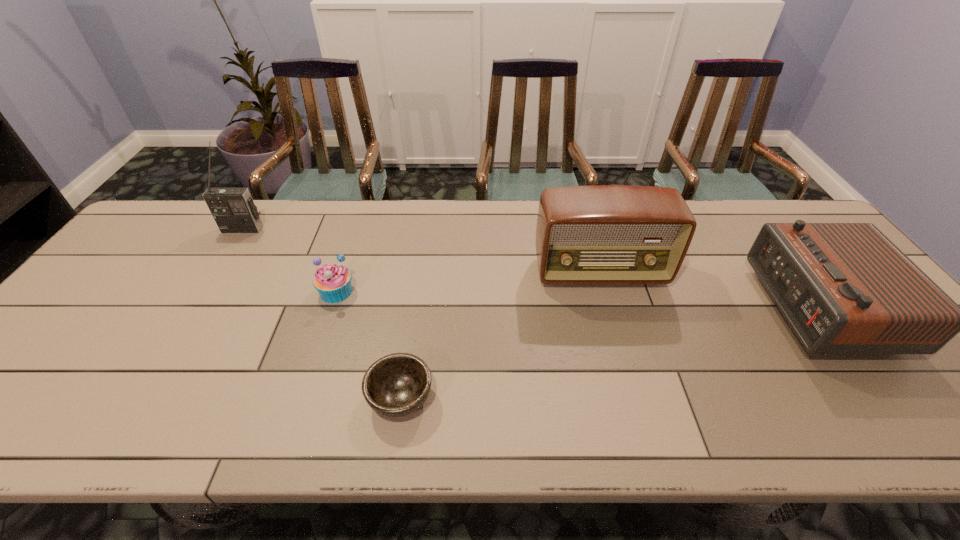
Identify the location of free space between the shortest object and the shortest radio receiver. Image resolution: width=960 pixels, height=540 pixels. (610, 353).

The image size is (960, 540). In order to click on vacant point located between the farthest object and the fourth tallest object in this screenshot , I will do `click(290, 260)`.

Locate an element on the screen. The image size is (960, 540). unoccupied position between the farthest radio receiver and the bowl is located at coordinates (322, 314).

Locate an element on the screen. The image size is (960, 540). object that is the third closest one to the muffin is located at coordinates (603, 234).

Identify which object is the third nearest to the rightmost object. Please provide its 2D coordinates. Your answer should be formatted as a tuple, i.e. [(x, y)], where the tuple contains the x and y coordinates of a point satisfying the conditions above.

[(333, 282)]

Locate an element on the screen. the third closest radio receiver relative to the fourth object from right to left is located at coordinates (844, 288).

Identify which radio receiver is the nearest to the leftmost radio receiver. Please provide its 2D coordinates. Your answer should be formatted as a tuple, i.e. [(x, y)], where the tuple contains the x and y coordinates of a point satisfying the conditions above.

[(603, 234)]

At what (x,y) coordinates should I click in order to perform the action: click on free location that satisfies the following two spatial constraints: 1. on the front side of the muffin; 2. on the right side of the bowl. Please return your answer as a coordinate pair (x, y). Image resolution: width=960 pixels, height=540 pixels. Looking at the image, I should click on (301, 398).

Where is `vacant area that satisfies the following two spatial constraints: 1. on the tuning display of the rightmost radio receiver; 2. on the front side of the shortest object`? Image resolution: width=960 pixels, height=540 pixels. vacant area that satisfies the following two spatial constraints: 1. on the tuning display of the rightmost radio receiver; 2. on the front side of the shortest object is located at coordinates 887,398.

At what (x,y) coordinates should I click in order to perform the action: click on free space that satisfies the following two spatial constraints: 1. on the display of the farthest object; 2. on the right side of the third object from left to right. Please return your answer as a coordinate pair (x, y). Image resolution: width=960 pixels, height=540 pixels. Looking at the image, I should click on (138, 398).